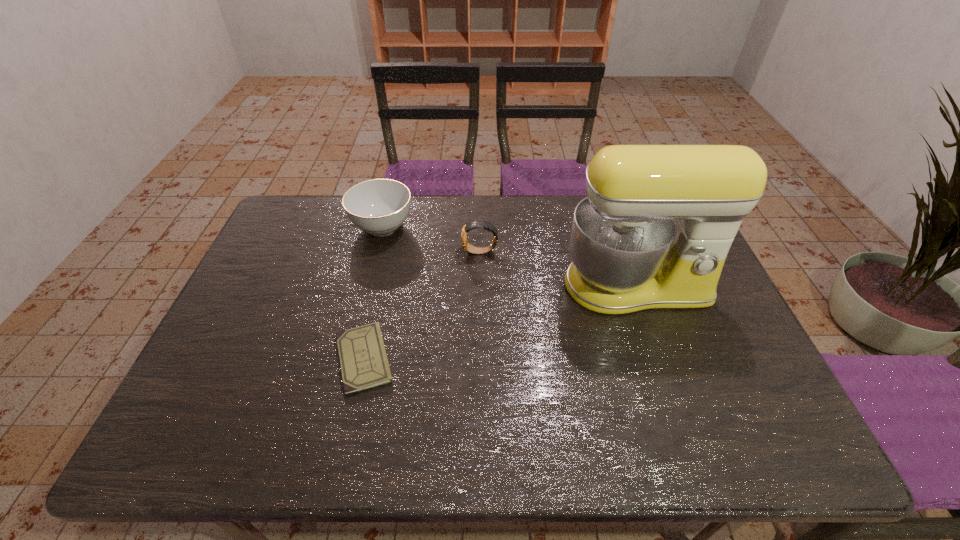
Locate an element on the screen. mixer is located at coordinates (654, 232).

Where is `the rightmost object`? The width and height of the screenshot is (960, 540). the rightmost object is located at coordinates (654, 232).

Locate an element on the screen. chinaware is located at coordinates coord(378,207).

Identify the location of the second object from right to left. (469, 248).

You are a GUI agent. You are given a task and a screenshot of the screen. Output one action in this format:
    pyautogui.click(x=<x>, y=<y>)
    Task: Click on the nearest object
    
    Given the screenshot: What is the action you would take?
    pyautogui.click(x=364, y=364)

Identify the location of checkbook. The width and height of the screenshot is (960, 540). (364, 364).

At what (x,y) coordinates should I click in order to perform the action: click on vacant space situated on the side of the tallest object with the control knob. Please return your answer as a coordinate pair (x, y). The image size is (960, 540). Looking at the image, I should click on (660, 359).

Locate an element on the screen. This screenshot has height=540, width=960. vacant space located 0.350m on the right of the chinaware is located at coordinates (518, 227).

You are a GUI agent. You are given a task and a screenshot of the screen. Output one action in this format:
    pyautogui.click(x=<x>, y=<y>)
    Task: Click on the vacant space located 0.130m on the face of the watch
    The height and width of the screenshot is (540, 960).
    Given the screenshot: What is the action you would take?
    pyautogui.click(x=421, y=252)

Where is `free spot located 0.350m on the face of the watch`? free spot located 0.350m on the face of the watch is located at coordinates (351, 252).